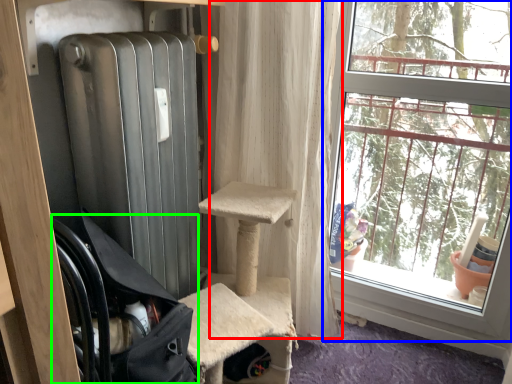
Question: Considering the real-world distances, which object is closest to curtain (highlighted by a red box)? window (highlighted by a blue box) or chair (highlighted by a green box).

Choices:
 (A) window
 (B) chair

Answer: (A)